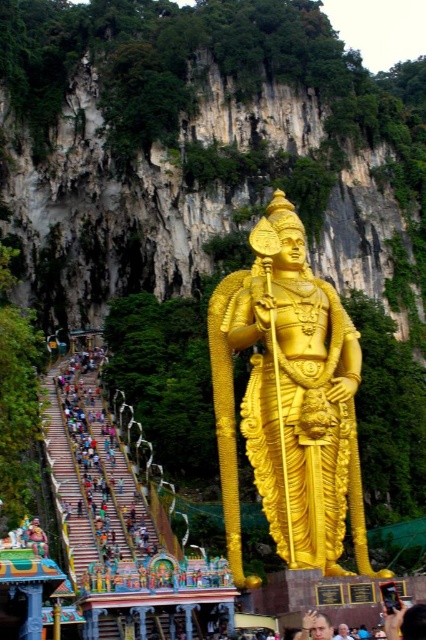
Question: Can you confirm if gold polished statue at center is bigger than smooth skin face at lower center?

Choices:
 (A) no
 (B) yes

Answer: (B)

Question: From the image, what is the correct spatial relationship of gold polished statue at center in relation to smooth skin face at lower center?

Choices:
 (A) right
 (B) left

Answer: (B)

Question: Is gold polished statue at center above smooth skin face at lower center?

Choices:
 (A) yes
 (B) no

Answer: (A)

Question: Which point appears farthest from the camera in this image?

Choices:
 (A) (299, 326)
 (B) (348, 637)

Answer: (A)